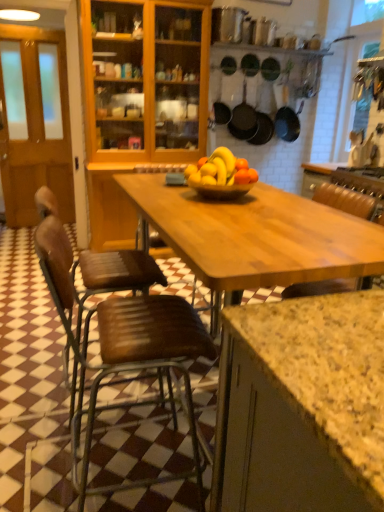
Question: Would you say matte black frying pan at upper center, the second frying pan in the right-to-left sequence, is to the left or to the right of translucent glass bowl at center in the picture?

Choices:
 (A) left
 (B) right

Answer: (B)

Question: Is point (271, 128) positioned closer to the camera than point (233, 197)?

Choices:
 (A) closer
 (B) farther

Answer: (B)

Question: Based on their relative distances, which object is nearer to the black matte frying pan at center, positioned as the 4th frying pan in right-to-left order?

Choices:
 (A) matte black frying pan at upper center, the second frying pan in the right-to-left sequence
 (B) black matte frying pan at upper center, arranged as the fourth frying pan when viewed from the left
 (C) translucent glass bowl at center
 (D) matte black frying pan at center, the second frying pan viewed from the left
 (E) brown wooden door at left

Answer: (D)

Question: Estimate the real-world distances between objects in this image. Which object is closer to the brown wooden chair at left, positioned as the 1th chair in back-to-front order?

Choices:
 (A) matte black frying pan at center, the second frying pan viewed from the left
 (B) black matte frying pan at upper center, marked as the first frying pan in a right-to-left arrangement
 (C) matte black frying pan at upper center, the second frying pan in the right-to-left sequence
 (D) translucent glass bowl at center
 (E) black matte frying pan at center, placed as the 1th frying pan when sorted from left to right

Answer: (D)